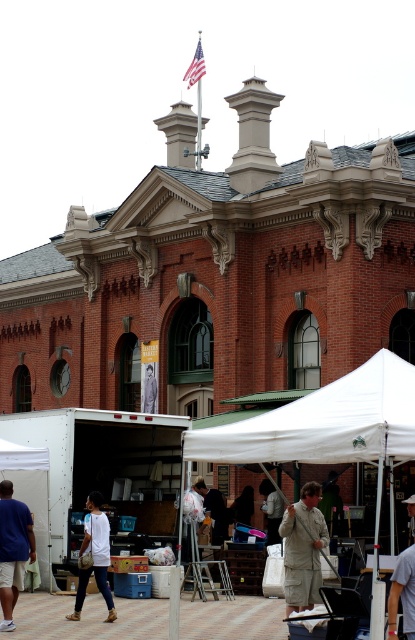
Based on the photo, who is positioned more to the right, white fabric tent at center or khaki pants at center?

Positioned to the right is white fabric tent at center.

The width and height of the screenshot is (415, 640). Describe the element at coordinates (329, 435) in the screenshot. I see `white fabric tent at center` at that location.

The width and height of the screenshot is (415, 640). Identify the location of white fabric tent at center. (329, 435).

How far apart are tan cotton shirt at center and matte black mask at center?

tan cotton shirt at center is 64.87 feet away from matte black mask at center.

Which is more to the right, tan cotton shirt at center or matte black mask at center?

From the viewer's perspective, matte black mask at center appears more on the right side.

The height and width of the screenshot is (640, 415). I want to click on tan cotton shirt at center, so [x=302, y=548].

Does white fabric tent at center have a greater height compared to blue cotton shirt at lower left?

Indeed, white fabric tent at center has a greater height compared to blue cotton shirt at lower left.

Describe the element at coordinates (329, 435) in the screenshot. The width and height of the screenshot is (415, 640). I see `white fabric tent at center` at that location.

Locate an element on the screen. white fabric tent at center is located at coordinates (329, 435).